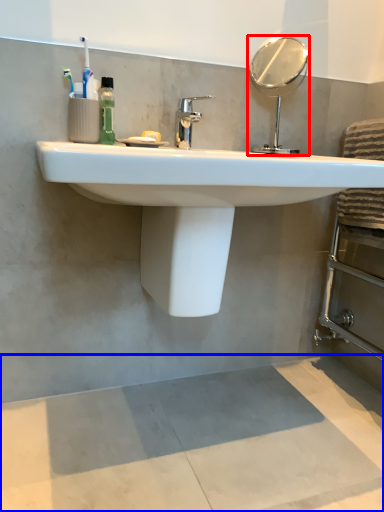
Question: Which object is closer to the camera taking this photo, mirror (highlighted by a red box) or concrete (highlighted by a blue box)?

Choices:
 (A) mirror
 (B) concrete

Answer: (B)